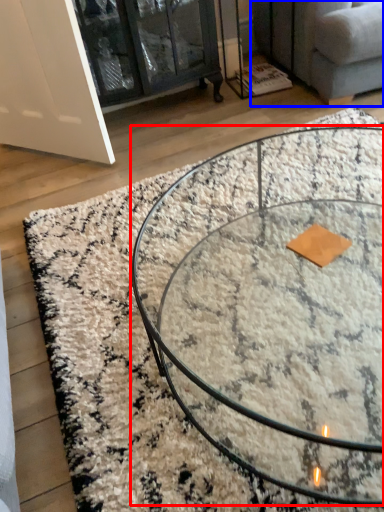
Question: Which of the following is the farthest to the observer, coffee table (highlighted by a red box) or studio couch (highlighted by a blue box)?

Choices:
 (A) coffee table
 (B) studio couch

Answer: (B)